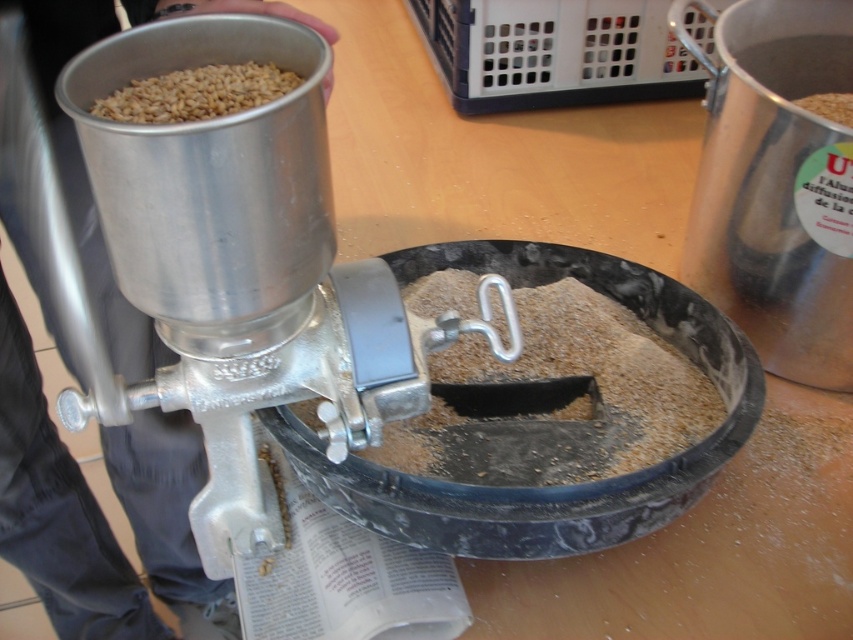
You are a baker who needs to determine which grain is higher in the image to decide where to pour more flour. Which of the brown matte grain at center or the golden matte grains at upper left is positioned higher?

The brown matte grain at center is taller than the golden matte grains at upper left, so it is positioned higher.

You are a baker preparing to grind grains for flour. You have two types of grains in the mill, the brown matte grain at center and the golden matte grains at upper left. Which grain type will produce a coarser flour when ground?

The brown matte grain at center has a larger size compared to golden matte grains at upper left, so it will produce a coarser flour when ground.

You are a baker who needs to measure the distance between the brown matte grain at center and the golden matte grains at upper left to ensure proper spacing for even grinding. Can you confirm if the distance is at least 18 inches?

The distance between the brown matte grain at center and the golden matte grains at upper left is 18.73 inches, which is more than 18 inches. Therefore, the spacing is sufficient for even grinding.